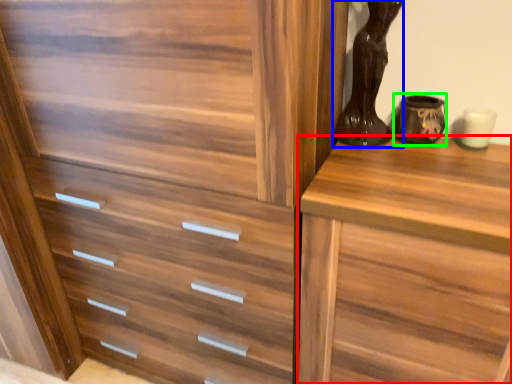
Question: Estimate the real-world distances between objects in this image. Which object is farther from chest of drawers (highlighted by a red box), vase (highlighted by a blue box) or vase (highlighted by a green box)?

Choices:
 (A) vase
 (B) vase

Answer: (B)